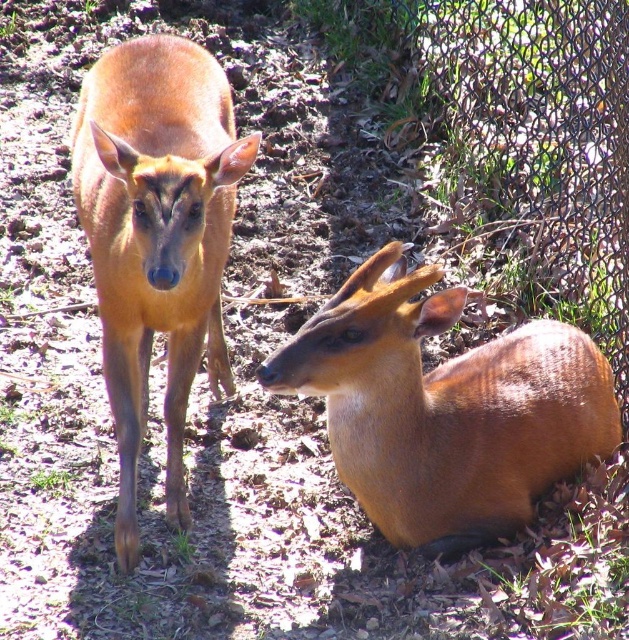
Find the location of `brown matte antelope at lower right`. brown matte antelope at lower right is located at coordinates [443, 406].

Consider the image. Can you confirm if brown matte antelope at lower right is shorter than brown matte antelope at left?

Yes.

Does point (442, 376) lie behind point (174, 401)?

Yes, it is behind point (174, 401).

This screenshot has width=629, height=640. In order to click on brown matte antelope at lower right in this screenshot , I will do `click(443, 406)`.